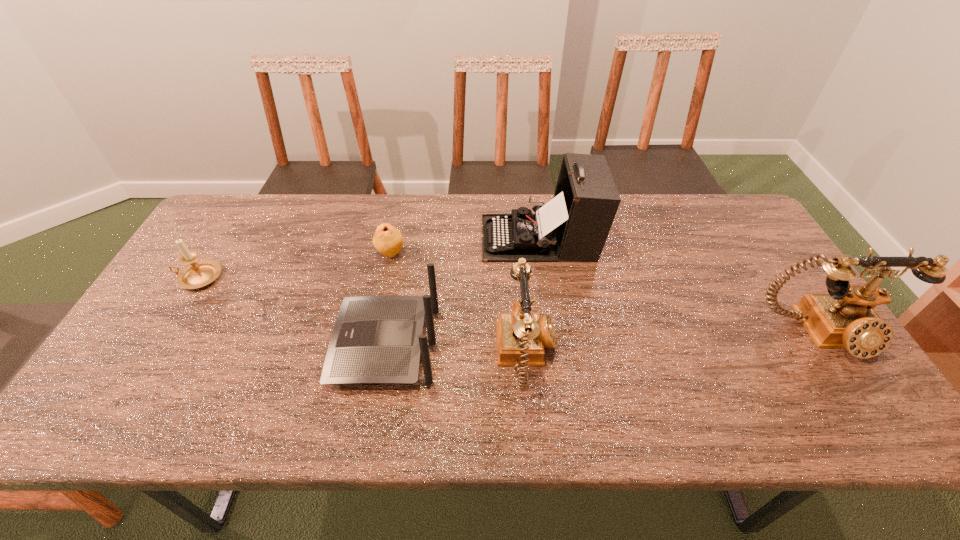
What are the coordinates of `the shorter telephone` in the screenshot? It's located at (521, 335).

Find the location of a particular element. The height and width of the screenshot is (540, 960). the rightmost object is located at coordinates (845, 318).

Image resolution: width=960 pixels, height=540 pixels. Identify the location of the right telephone. (845, 318).

What are the coordinates of `typewriter` in the screenshot? It's located at (574, 225).

Where is `the fifth tallest object`? The width and height of the screenshot is (960, 540). the fifth tallest object is located at coordinates (201, 273).

Locate an element on the screen. candle holder is located at coordinates (201, 273).

Identify the location of the shortest object. (387, 240).

Find the location of a particular element. This screenshot has height=540, width=960. the fourth tallest object is located at coordinates (376, 339).

Locate an element on the screen. This screenshot has width=960, height=540. vacant space situated on the dial number of the shorter telephone is located at coordinates (657, 356).

The image size is (960, 540). I want to click on free space located 0.080m inside the open case of the typewriter, so click(x=456, y=238).